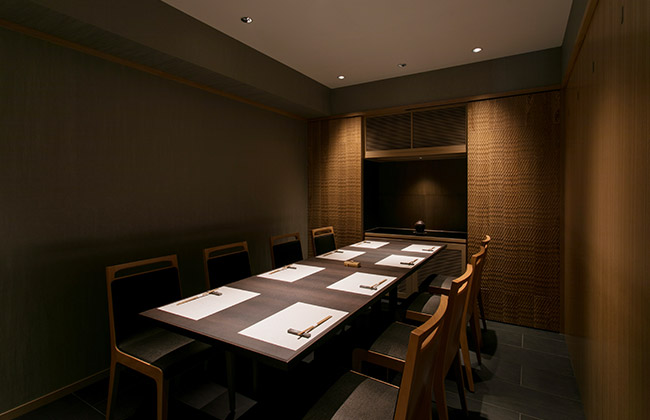
Locate an element on the screen. This screenshot has height=420, width=650. green wall is located at coordinates (125, 173).